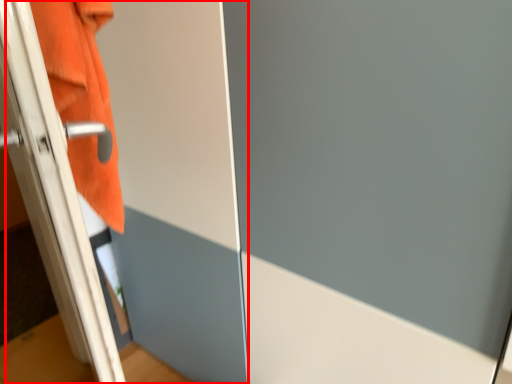
Question: From the image, what is the correct spatial relationship of screen door (annotated by the red box) in relation to bath towel?

Choices:
 (A) left
 (B) right

Answer: (A)